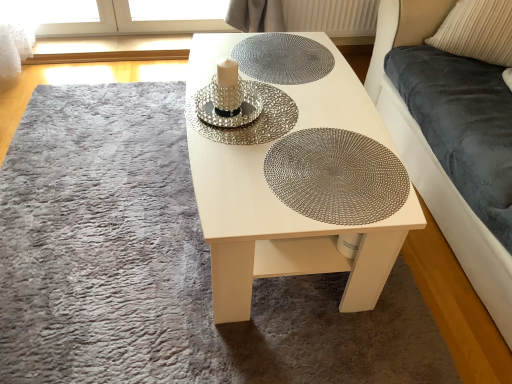
Locate an element on the screen. vacant space situated above white wood table at center (from a real-world perspective) is located at coordinates (292, 110).